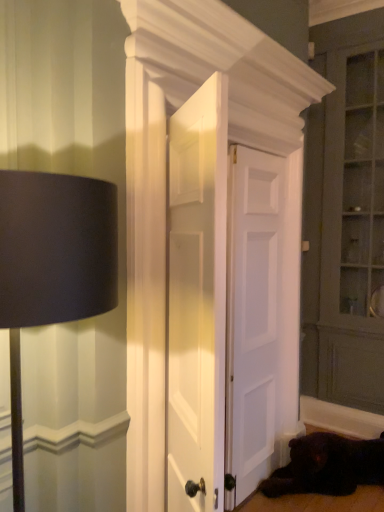
Question: Is black matte lampshade at left positioned behind shiny black fur at lower right?

Choices:
 (A) yes
 (B) no

Answer: (B)

Question: Can you confirm if black matte lampshade at left is smaller than shiny black fur at lower right?

Choices:
 (A) no
 (B) yes

Answer: (A)

Question: Does black matte lampshade at left have a lesser width compared to shiny black fur at lower right?

Choices:
 (A) yes
 (B) no

Answer: (A)

Question: Considering the relative sizes of black matte lampshade at left and shiny black fur at lower right in the image provided, is black matte lampshade at left wider than shiny black fur at lower right?

Choices:
 (A) yes
 (B) no

Answer: (B)

Question: Is black matte lampshade at left aimed at shiny black fur at lower right?

Choices:
 (A) no
 (B) yes

Answer: (A)

Question: In terms of height, does white painted wood door at center, placed as the 2th door when sorted from front to back, look taller or shorter compared to white wooden door at center, arranged as the first door when viewed from the front?

Choices:
 (A) short
 (B) tall

Answer: (B)

Question: Is point (254, 480) closer or farther from the camera than point (213, 411)?

Choices:
 (A) closer
 (B) farther

Answer: (B)

Question: Is white painted wood door at center, the 2th door from the back, situated inside white wooden door at center, which ranks as the 3th door in back-to-front order, or outside?

Choices:
 (A) outside
 (B) inside

Answer: (A)

Question: Would you say white painted wood door at center, the 2th door from the back, is to the left or to the right of white wooden door at center, arranged as the first door when viewed from the front, in the picture?

Choices:
 (A) right
 (B) left

Answer: (A)

Question: Relative to white wooden door at center, arranged as the first door when viewed from the front, is matte gray dresser at right in front or behind?

Choices:
 (A) front
 (B) behind

Answer: (B)

Question: Looking at the image, does matte gray dresser at right seem bigger or smaller compared to white wooden door at center, which ranks as the 3th door in back-to-front order?

Choices:
 (A) small
 (B) big

Answer: (B)

Question: Considering the positions of matte gray dresser at right and white wooden door at center, which ranks as the 3th door in back-to-front order, in the image, is matte gray dresser at right wider or thinner than white wooden door at center, which ranks as the 3th door in back-to-front order,?

Choices:
 (A) thin
 (B) wide

Answer: (B)

Question: From a real-world perspective, is matte gray dresser at right positioned above or below white wooden door at center, arranged as the first door when viewed from the front?

Choices:
 (A) below
 (B) above

Answer: (B)

Question: In the image, is white painted wood door at center, the 2th door from the back, positioned in front of or behind matte gray dresser at right?

Choices:
 (A) front
 (B) behind

Answer: (A)

Question: Based on their sizes in the image, would you say white painted wood door at center, placed as the 2th door when sorted from front to back, is bigger or smaller than matte gray dresser at right?

Choices:
 (A) big
 (B) small

Answer: (B)